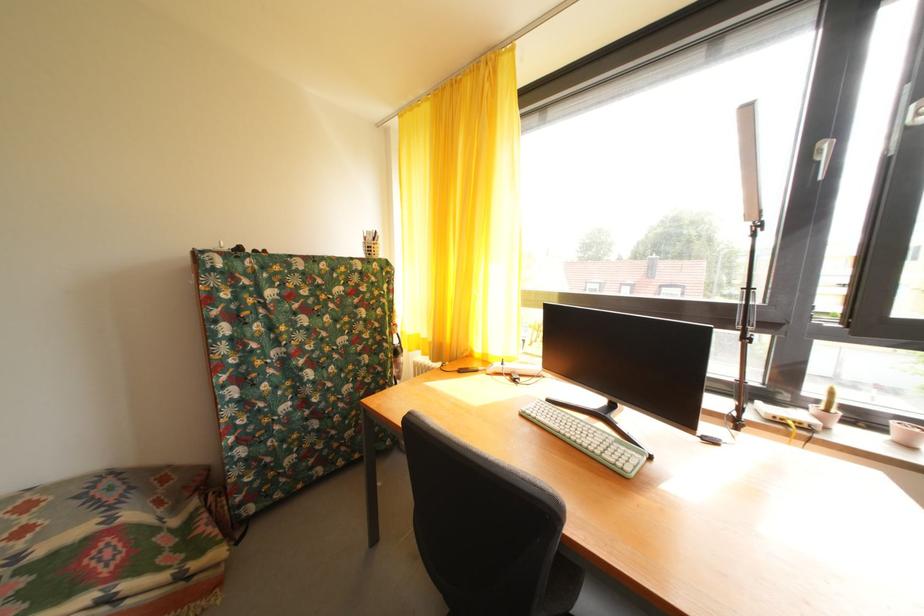
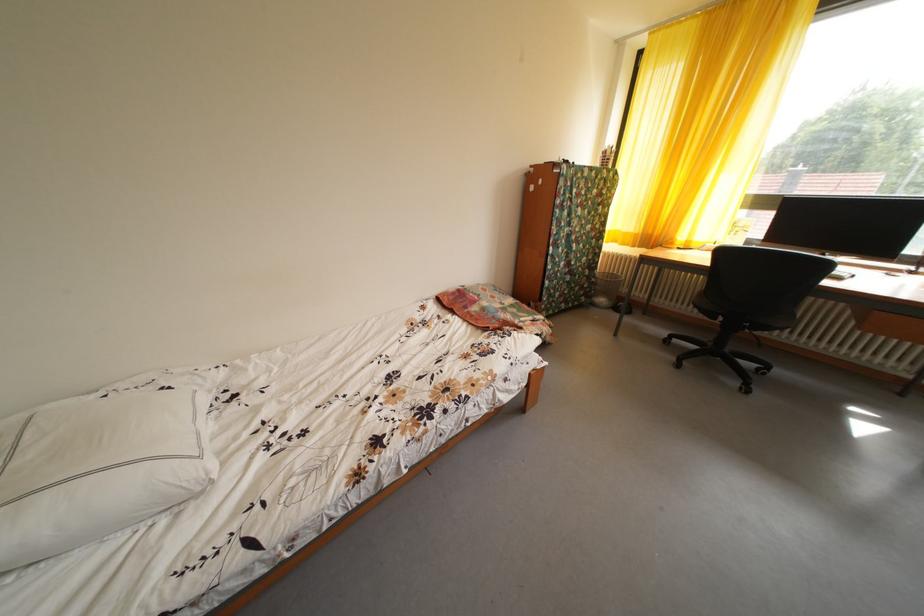
In a continuous first-person perspective shot, in which direction is the camera moving?

The cameraman moved toward left, backward.